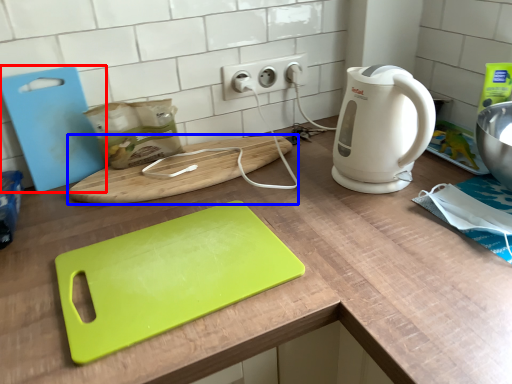
Question: Which point is further to the camera, cutting board (highlighted by a red box) or cutting board (highlighted by a blue box)?

Choices:
 (A) cutting board
 (B) cutting board

Answer: (B)